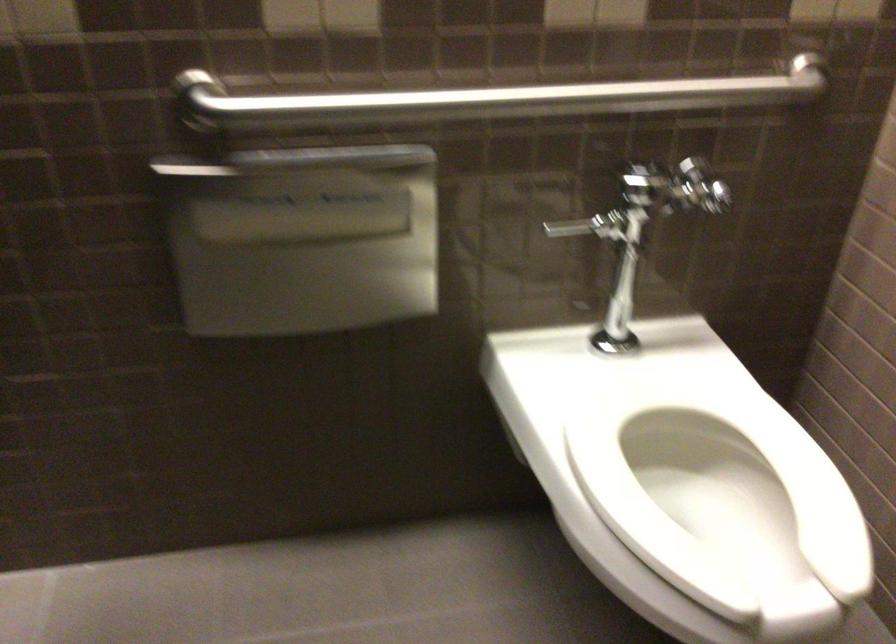
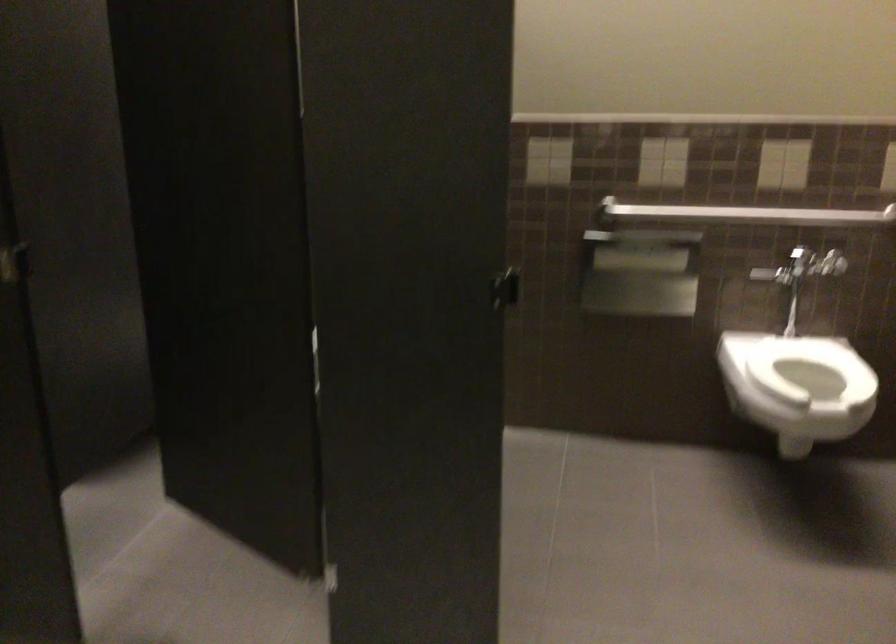
The point at (513, 118) is marked in the first image. Where is the corresponding point in the second image?

(745, 214)